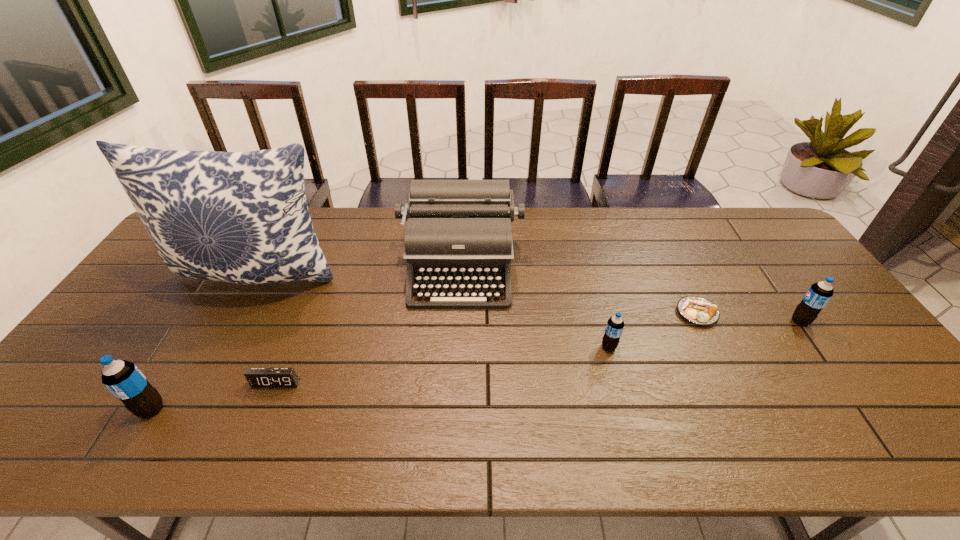
Image resolution: width=960 pixels, height=540 pixels. I want to click on alarm clock, so click(x=257, y=377).

You are a GUI agent. You are given a task and a screenshot of the screen. Output one action in this format:
    pyautogui.click(x=<x>, y=<y>)
    Task: Click on the second nearest object
    The width and height of the screenshot is (960, 540).
    Given the screenshot: What is the action you would take?
    pyautogui.click(x=257, y=377)

The height and width of the screenshot is (540, 960). I want to click on free space located 0.140m on the right of the tallest soda bottle, so click(x=225, y=409).

I want to click on vacant area situated on the back of the fifth farthest object, so click(x=598, y=308).

Find the location of a particular element. The image size is (960, 540). free location located on the back of the rightmost soda bottle is located at coordinates (760, 265).

The height and width of the screenshot is (540, 960). I want to click on vacant space located 0.200m on the typing side of the typewriter, so click(x=456, y=367).

You are a GUI agent. You are given a task and a screenshot of the screen. Output one action in this format:
    pyautogui.click(x=<x>, y=<y>)
    Task: Click on the free space located on the front surface of the tallest object
    This screenshot has width=960, height=540.
    Given the screenshot: What is the action you would take?
    pyautogui.click(x=197, y=391)

Identify the location of vacant region located on the back of the second object from right to left. (676, 269).

I want to click on object that is at the far edge, so click(458, 231).

Where is `soda bottle present at the near edge`? soda bottle present at the near edge is located at coordinates (123, 379).